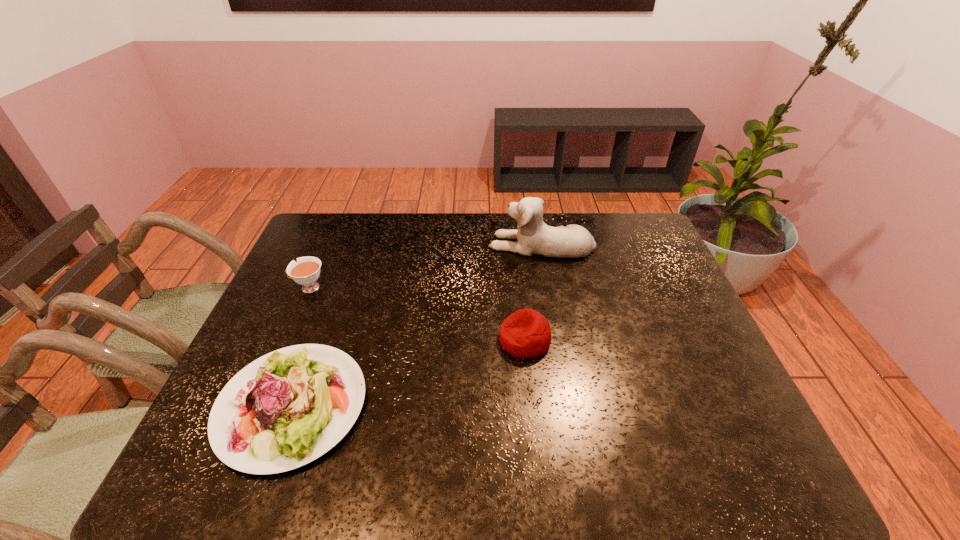
Find the location of a particular element. Image resolution: width=960 pixels, height=540 pixels. free space located 0.160m on the seat area of the beanbag is located at coordinates (438, 339).

The image size is (960, 540). I want to click on vacant space situated 0.260m on the back of the salad plate, so click(x=338, y=281).

You are a GUI agent. You are given a task and a screenshot of the screen. Output one action in this format:
    pyautogui.click(x=<x>, y=<y>)
    Task: Click on the object present at the far edge
    The height and width of the screenshot is (540, 960).
    Given the screenshot: What is the action you would take?
    pyautogui.click(x=534, y=236)

You are a GUI agent. You are given a task and a screenshot of the screen. Output one action in this format:
    pyautogui.click(x=<x>, y=<y>)
    Task: Click on the object that is positioned at the near edge
    The image size is (960, 540).
    Given the screenshot: What is the action you would take?
    pyautogui.click(x=287, y=408)

At what (x,y) coordinates should I click in order to perform the action: click on teacup present at the left edge. Please return your answer as a coordinate pair (x, y). The height and width of the screenshot is (540, 960). Looking at the image, I should click on (306, 271).

Find the location of a particular element. Image resolution: width=960 pixels, height=540 pixels. salad plate situated at the left edge is located at coordinates (287, 408).

Where is `object that is at the near left corner`? Image resolution: width=960 pixels, height=540 pixels. object that is at the near left corner is located at coordinates (287, 408).

The width and height of the screenshot is (960, 540). Identify the location of vacant region at the far edge of the desktop. (410, 222).

Image resolution: width=960 pixels, height=540 pixels. I want to click on free space at the left edge of the desktop, so click(268, 303).

The height and width of the screenshot is (540, 960). Find the location of `free location at the right edge`. free location at the right edge is located at coordinates (682, 338).